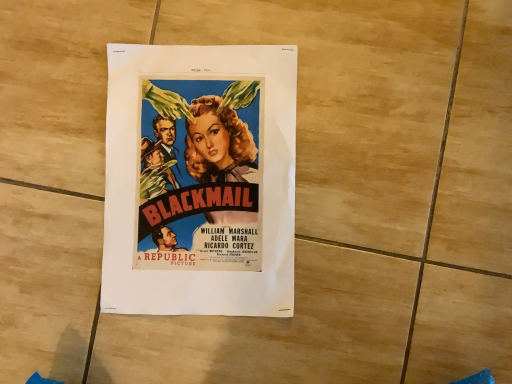
The width and height of the screenshot is (512, 384). I want to click on vacant region above matte paper poster at center (from a real-world perspective), so click(202, 171).